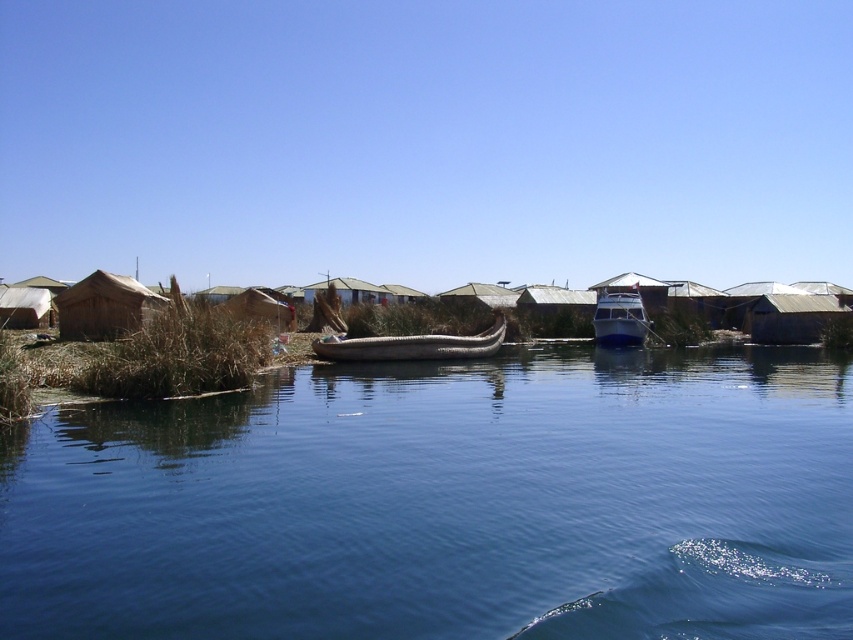
Question: Which object is the farthest from the brown woven boat at center?

Choices:
 (A) clear blue water at center
 (B) metallic blue boat at center

Answer: (A)

Question: Which object appears farthest from the camera in this image?

Choices:
 (A) clear blue water at center
 (B) metallic blue boat at center
 (C) brown woven boat at center

Answer: (B)

Question: Is clear blue water at center positioned behind brown woven boat at center?

Choices:
 (A) yes
 (B) no

Answer: (B)

Question: Can you confirm if brown woven boat at center is positioned to the left of metallic blue boat at center?

Choices:
 (A) no
 (B) yes

Answer: (B)

Question: Does brown woven boat at center have a smaller size compared to metallic blue boat at center?

Choices:
 (A) no
 (B) yes

Answer: (A)

Question: Which of the following is the closest to the observer?

Choices:
 (A) (349, 352)
 (B) (347, 547)
 (C) (622, 340)

Answer: (B)